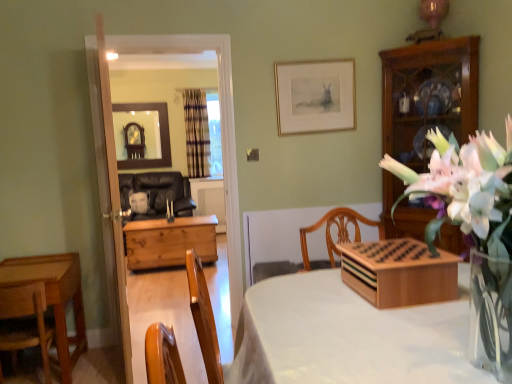
Question: Does wooden chest at center appear on the right side of wooden game board at center?

Choices:
 (A) yes
 (B) no

Answer: (B)

Question: Can you confirm if wooden chest at center is bigger than wooden game board at center?

Choices:
 (A) yes
 (B) no

Answer: (A)

Question: Does wooden chest at center turn towards wooden game board at center?

Choices:
 (A) yes
 (B) no

Answer: (B)

Question: Is wooden chest at center taller than wooden game board at center?

Choices:
 (A) no
 (B) yes

Answer: (B)

Question: Would you say wooden chest at center is a long distance from wooden game board at center?

Choices:
 (A) no
 (B) yes

Answer: (B)

Question: Would you say wooden chest at center is inside or outside black leather couch at left, the second chair from the bottom?

Choices:
 (A) outside
 (B) inside

Answer: (A)

Question: From the image's perspective, is wooden chest at center positioned above or below black leather couch at left, the first chair in the back-to-front sequence?

Choices:
 (A) below
 (B) above

Answer: (A)

Question: From their relative heights in the image, would you say wooden chest at center is taller or shorter than black leather couch at left, the second chair from the bottom?

Choices:
 (A) short
 (B) tall

Answer: (A)

Question: From a real-world perspective, is wooden chest at center positioned above or below black leather couch at left, which ranks as the second chair in front-to-back order?

Choices:
 (A) below
 (B) above

Answer: (A)

Question: In terms of height, does wooden cabinet at right look taller or shorter compared to plaid fabric curtain at center?

Choices:
 (A) short
 (B) tall

Answer: (B)

Question: Based on their sizes in the image, would you say wooden cabinet at right is bigger or smaller than plaid fabric curtain at center?

Choices:
 (A) big
 (B) small

Answer: (A)

Question: From the image's perspective, is wooden cabinet at right above or below plaid fabric curtain at center?

Choices:
 (A) above
 (B) below

Answer: (B)

Question: Would you say wooden cabinet at right is inside or outside plaid fabric curtain at center?

Choices:
 (A) outside
 (B) inside

Answer: (A)

Question: In the image, is matte gold picture frame at upper center positioned in front of or behind wooden door at left?

Choices:
 (A) front
 (B) behind

Answer: (B)

Question: Would you say matte gold picture frame at upper center is to the left or to the right of wooden door at left in the picture?

Choices:
 (A) right
 (B) left

Answer: (A)